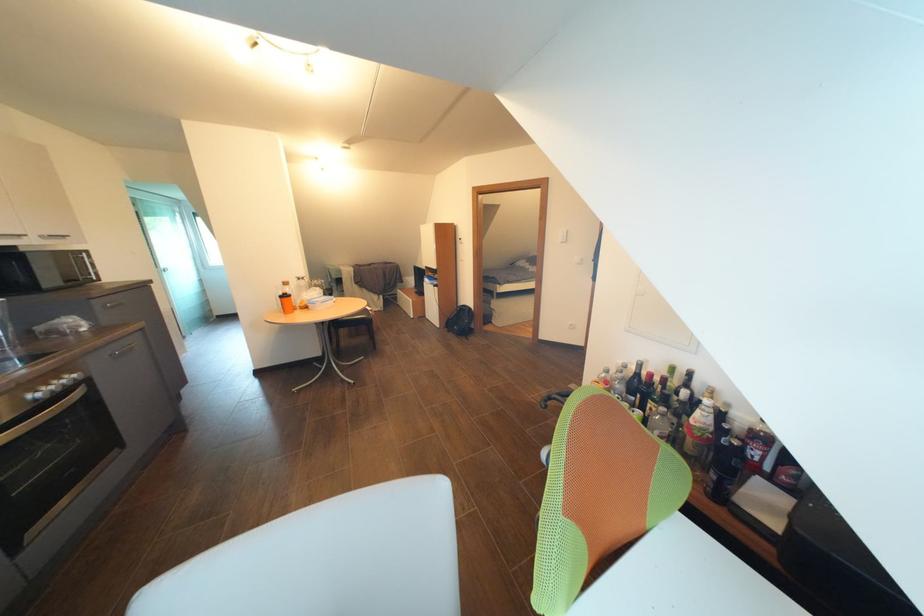
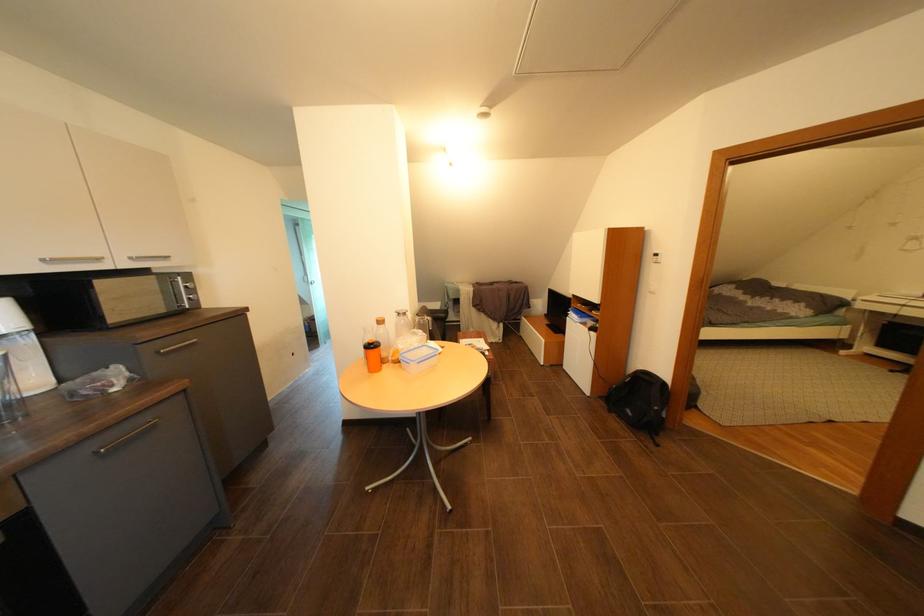
Which direction would the cameraman need to move to produce the second image?

The cameraman walked toward left, forward.